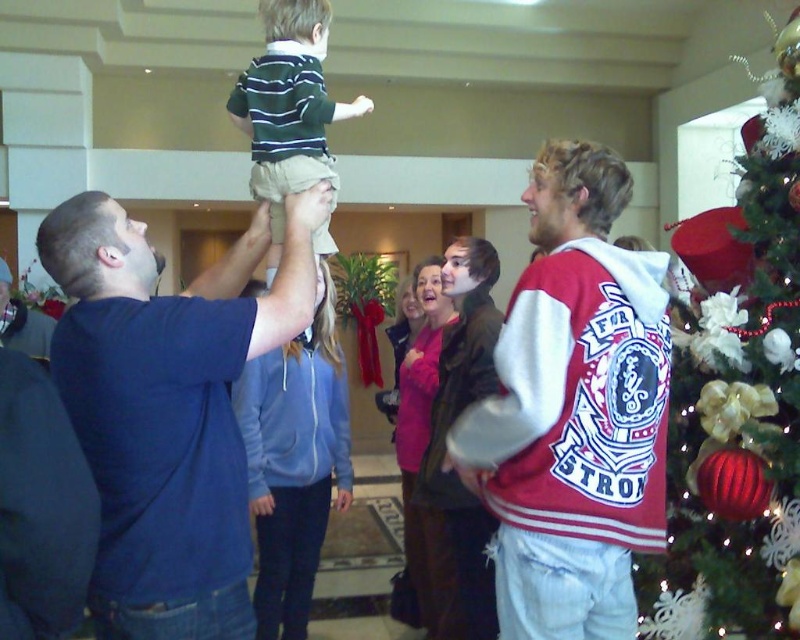
You are standing in the room and want to place a small decoration between the two points, point (x=616, y=288) and point (x=778, y=246). Which point should you start from to ensure the decoration is closer to the Christmas tree?

Point (x=778, y=246) is farther from the viewer than point (x=616, y=288). Since the Christmas tree is on the right side of the frame, placing the decoration starting from point (x=778, y=246) would position it closer to the tree.

You are standing in the festive living room and want to place a small decoration on one of two points marked in the image. The first point is at coordinates point (100, 458) and the second is at point (278, 204). Which point is closer to you?

Point (100, 458) is closer to the viewer than point (278, 204), so you should place the decoration there if you want it nearer to your current position.